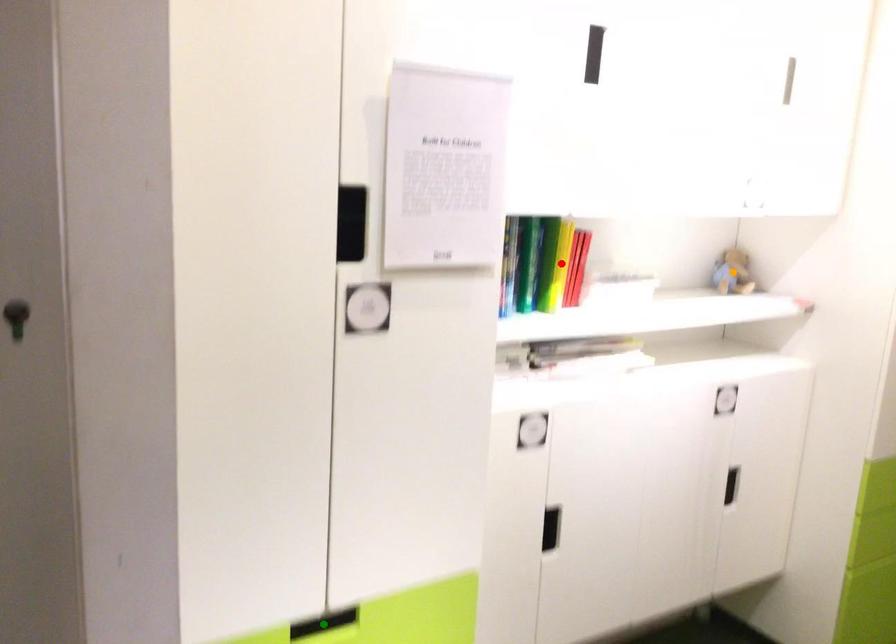
Order these from nearest to farthest:
1. red point
2. orange point
3. green point

green point, red point, orange point